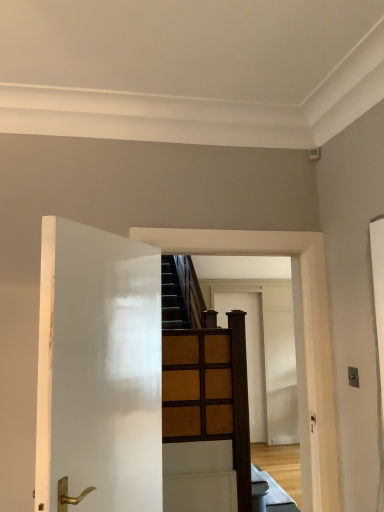
Question: Is brown wooden door at center, the second door positioned from the front, at the back of white glossy door at left, the second door in the right-to-left sequence?

Choices:
 (A) yes
 (B) no

Answer: (B)

Question: From the image's perspective, does white glossy door at left, which ranks as the 1th door in front-to-back order, appear lower than brown wooden door at center, the second door positioned from the front?

Choices:
 (A) no
 (B) yes

Answer: (A)

Question: Considering the relative sizes of white glossy door at left, which ranks as the 1th door in front-to-back order, and brown wooden door at center, positioned as the second door in left-to-right order, in the image provided, is white glossy door at left, which ranks as the 1th door in front-to-back order, shorter than brown wooden door at center, positioned as the second door in left-to-right order,?

Choices:
 (A) no
 (B) yes

Answer: (B)

Question: Is white glossy door at left, which ranks as the 1th door in front-to-back order, further to camera compared to brown wooden door at center, arranged as the 1th door when viewed from the back?

Choices:
 (A) yes
 (B) no

Answer: (B)

Question: Is the depth of white glossy door at left, which is counted as the second door, starting from the back, less than that of brown wooden door at center, the 1th door viewed from the right?

Choices:
 (A) no
 (B) yes

Answer: (B)

Question: Is the surface of white glossy door at left, which is counted as the second door, starting from the back, in direct contact with brown wooden door at center, arranged as the 1th door when viewed from the back?

Choices:
 (A) no
 (B) yes

Answer: (A)

Question: Does brown wooden door at center, the second door positioned from the front, lie behind white glossy door at left, which ranks as the first door in left-to-right order?

Choices:
 (A) yes
 (B) no

Answer: (A)

Question: Is brown wooden door at center, the 1th door viewed from the right, facing away from white glossy door at left, which is counted as the second door, starting from the back?

Choices:
 (A) no
 (B) yes

Answer: (A)

Question: Is brown wooden door at center, arranged as the 1th door when viewed from the back, aimed at white glossy door at left, the second door in the right-to-left sequence?

Choices:
 (A) no
 (B) yes

Answer: (A)

Question: Is there a large distance between brown wooden door at center, arranged as the 1th door when viewed from the back, and white glossy door at left, which ranks as the first door in left-to-right order?

Choices:
 (A) yes
 (B) no

Answer: (A)

Question: From the image's perspective, is brown wooden door at center, the 1th door viewed from the right, below white glossy door at left, which is counted as the second door, starting from the back?

Choices:
 (A) no
 (B) yes

Answer: (B)

Question: Is brown wooden door at center, arranged as the 1th door when viewed from the back, in front of white glossy door at left, which ranks as the first door in left-to-right order?

Choices:
 (A) yes
 (B) no

Answer: (B)

Question: Considering their positions, is white glossy door at left, which is counted as the second door, starting from the back, located in front of or behind brown wooden door at center, the 1th door viewed from the right?

Choices:
 (A) behind
 (B) front

Answer: (B)